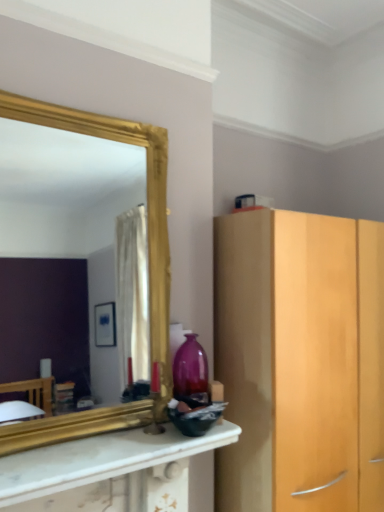
Question: From a real-world perspective, is white marble countertop at center above or below matte purple glass vase at center?

Choices:
 (A) below
 (B) above

Answer: (A)

Question: Considering the positions of white marble countertop at center and matte purple glass vase at center in the image, is white marble countertop at center taller or shorter than matte purple glass vase at center?

Choices:
 (A) short
 (B) tall

Answer: (A)

Question: Which object is the closest to the gold-framed mirror at upper left?

Choices:
 (A) white marble countertop at center
 (B) matte purple glass vase at center

Answer: (A)

Question: Estimate the real-world distances between objects in this image. Which object is farther from the matte purple glass vase at center?

Choices:
 (A) gold-framed mirror at upper left
 (B) white marble countertop at center

Answer: (A)